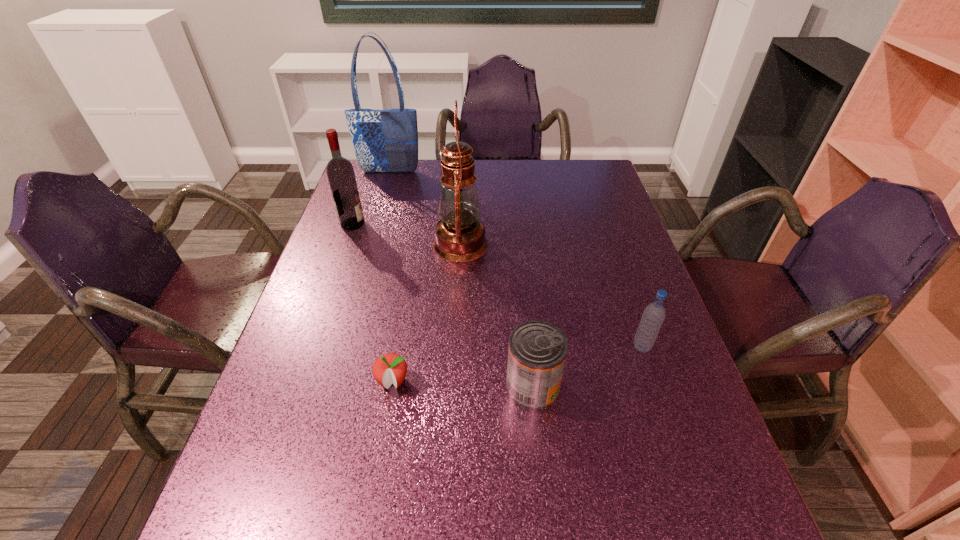
Find the location of a particular element. empty space between the fifth tallest object and the oil lamp is located at coordinates (496, 315).

Identify the location of unoccupied area between the shopping bag and the oil lamp. (x=425, y=208).

You are a GUI agent. You are given a task and a screenshot of the screen. Output one action in this format:
    pyautogui.click(x=<x>, y=<y>)
    Task: Click on the second closest object to the farthest object
    
    Given the screenshot: What is the action you would take?
    pyautogui.click(x=460, y=236)

Locate which object ranks second in proximity to the fifth object from left to right. Please provide its 2D coordinates. Your answer should be formatted as a tuple, i.e. [(x, y)], where the tuple contains the x and y coordinates of a point satisfying the conditions above.

[(391, 368)]

This screenshot has height=540, width=960. Find the location of `free space in the image that satisfies the following two spatial constraints: 1. on the front-facing side of the farthest object; 2. on the right side of the fifth object from left to right`. free space in the image that satisfies the following two spatial constraints: 1. on the front-facing side of the farthest object; 2. on the right side of the fifth object from left to right is located at coordinates (326, 387).

The width and height of the screenshot is (960, 540). What are the coordinates of `free point that satisfies the following two spatial constraints: 1. on the front-facing side of the shopping bag; 2. on the left side of the oil lamp` in the screenshot? It's located at (369, 244).

At what (x,y) coordinates should I click in order to perform the action: click on vacant space that satisfies the following two spatial constraints: 1. on the front and back of the fourth object from left to right; 2. on the left side of the third tallest object. Please return your answer as a coordinate pair (x, y). Looking at the image, I should click on (346, 244).

At what (x,y) coordinates should I click in order to perform the action: click on vacant region that satisfies the following two spatial constraints: 1. on the front and back of the third tallest object; 2. on the right side of the third object from right to left. Please return your answer as a coordinate pair (x, y). The height and width of the screenshot is (540, 960). Looking at the image, I should click on (346, 244).

You are a GUI agent. You are given a task and a screenshot of the screen. Output one action in this format:
    pyautogui.click(x=<x>, y=<y>)
    Task: Click on the vacant space that satisfies the following two spatial constraints: 1. on the front side of the fifth tallest object; 2. on the right side of the oil lamp
    
    Given the screenshot: What is the action you would take?
    pyautogui.click(x=453, y=387)

I want to click on vacant space that satisfies the following two spatial constraints: 1. on the front-facing side of the fifth object from left to right; 2. on the right side of the farthest object, so click(x=326, y=387).